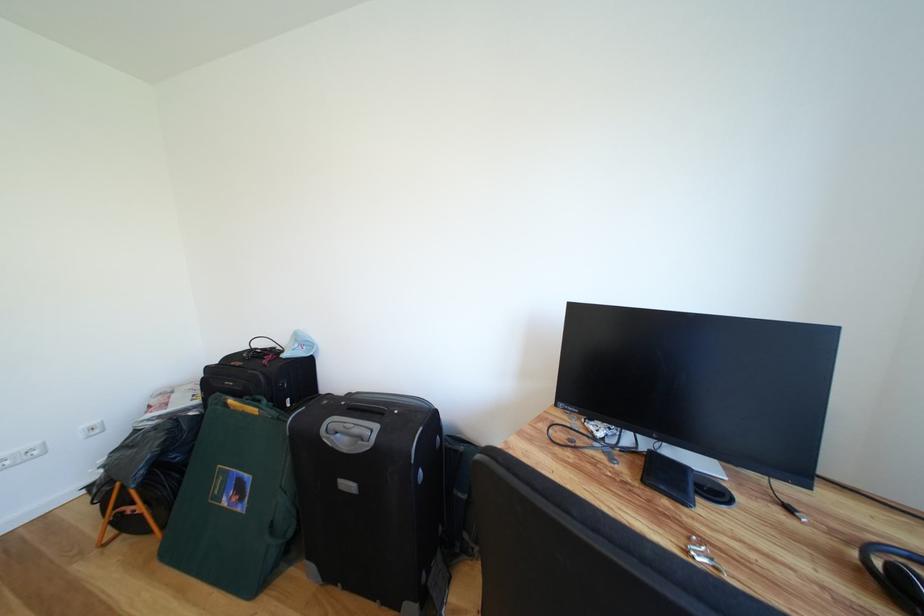
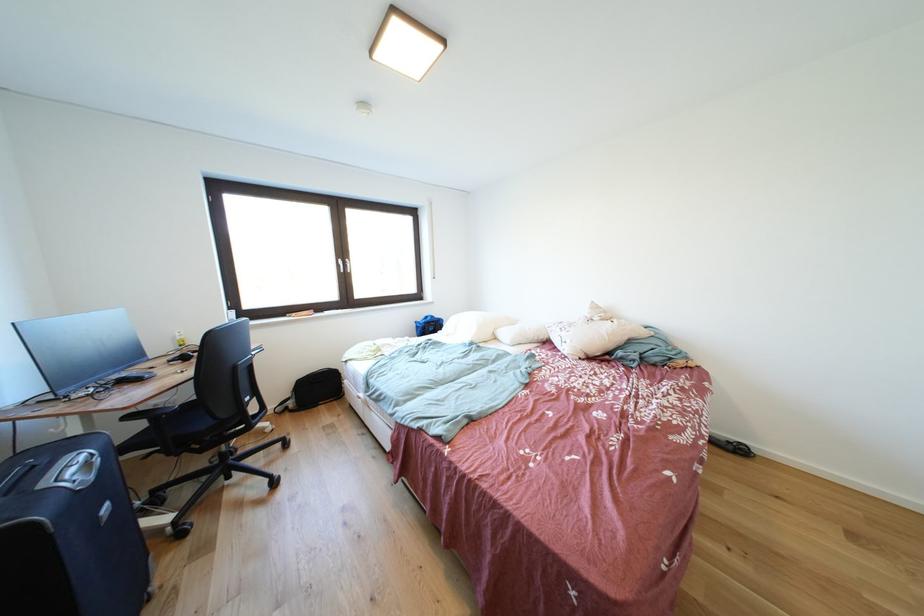
Find the pixel in the second image that matches [353,455] in the first image.

(101, 483)